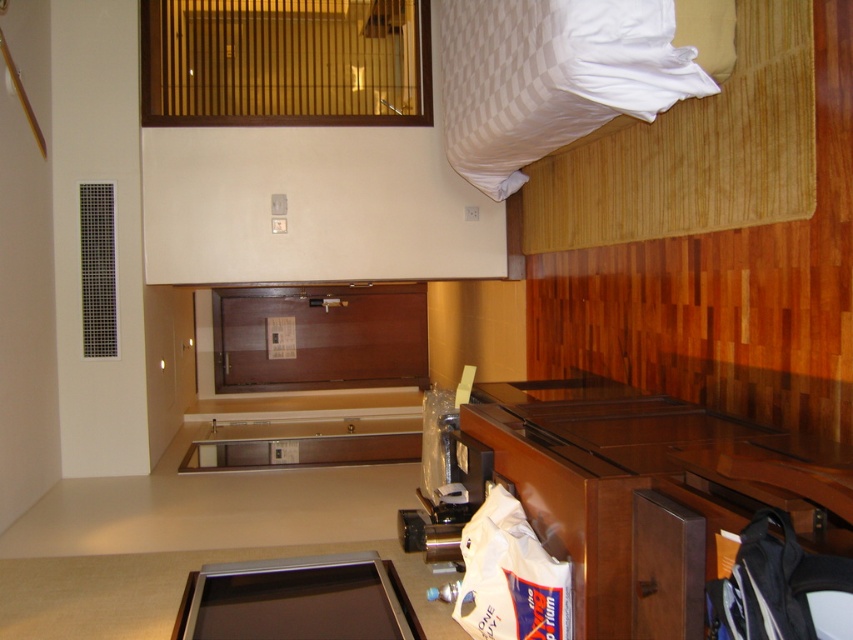
Is white striped pillow at upper right above metallic flat panel at lower center?

Indeed, white striped pillow at upper right is positioned over metallic flat panel at lower center.

Does point (498, 189) come closer to viewer compared to point (317, 588)?

No, (498, 189) is behind (317, 588).

Image resolution: width=853 pixels, height=640 pixels. Find the location of `white striped pillow at upper right`. white striped pillow at upper right is located at coordinates (x=552, y=77).